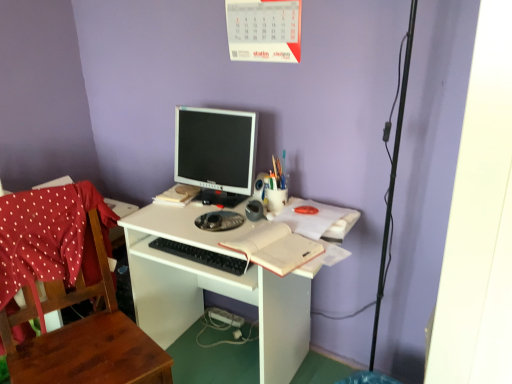
Question: In terms of width, does matte black monitor at center look wider or thinner when compared to wooden chair at left?

Choices:
 (A) thin
 (B) wide

Answer: (A)

Question: From their relative heights in the image, would you say matte black monitor at center is taller or shorter than wooden chair at left?

Choices:
 (A) tall
 (B) short

Answer: (B)

Question: Which object is the farthest from the matte black monitor at center?

Choices:
 (A) white matte desk at center
 (B) wooden chair at left
 (C) black plastic keyboard at center
 (D) white matte notebook at center
 (E) multicolored plastic pen holder at center

Answer: (B)

Question: Considering the real-world distances, which object is farthest from the matte black monitor at center?

Choices:
 (A) black plastic keyboard at center
 (B) wooden chair at left
 (C) white matte desk at center
 (D) multicolored plastic pen holder at center
 (E) white matte notebook at center

Answer: (B)